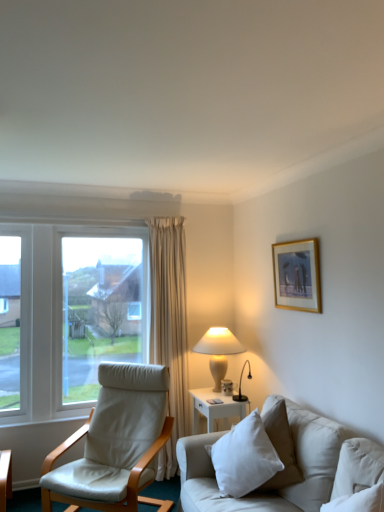
Question: Considering the positions of point (244, 438) and point (233, 339), is point (244, 438) closer or farther from the camera than point (233, 339)?

Choices:
 (A) closer
 (B) farther

Answer: (A)

Question: Looking at their shapes, would you say white cotton pillow at lower right, the 1th pillow from the back, is wider or thinner than white ceramic table lamp at center-right?

Choices:
 (A) wide
 (B) thin

Answer: (A)

Question: Which is farther from the white fabric couch at lower right?

Choices:
 (A) white ceramic table lamp at center-right
 (B) white cotton pillow at lower right, the 1th pillow from the back
 (C) gold-framed artwork at upper right
 (D) white soft pillow at lower right, the 1th pillow positioned from the front
 (E) white leather chair at left

Answer: (A)

Question: Which is farther from the white soft pillow at lower right, the 1th pillow positioned from the front?

Choices:
 (A) white fabric couch at lower right
 (B) white leather chair at left
 (C) white cotton pillow at lower right, which is the second pillow from right to left
 (D) gold-framed artwork at upper right
 (E) white ceramic table lamp at center-right

Answer: (B)